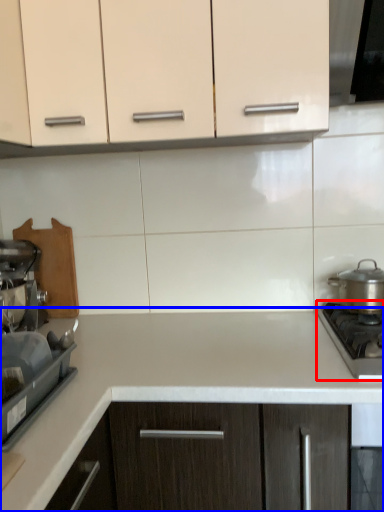
Question: Among these objects, which one is farthest to the camera, gas stove (highlighted by a red box) or countertop (highlighted by a blue box)?

Choices:
 (A) gas stove
 (B) countertop

Answer: (A)